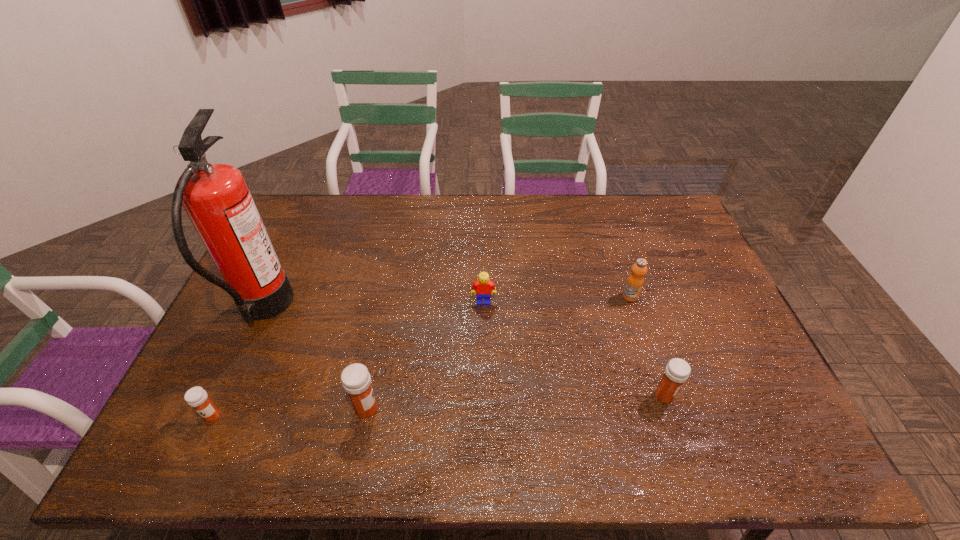
At what (x,y) coordinates should I click in order to perform the action: click on free point between the tallest object and the shortest object. Please return your answer as a coordinate pair (x, y). The height and width of the screenshot is (540, 960). Looking at the image, I should click on (237, 363).

Locate which object ranks third in proximity to the orange juice. Please provide its 2D coordinates. Your answer should be formatted as a tuple, i.e. [(x, y)], where the tuple contains the x and y coordinates of a point satisfying the conditions above.

[(356, 380)]

Find the location of a particular element. The image size is (960, 540). object that is the second closest to the fourth object from right to left is located at coordinates (196, 397).

Choose which medicine is the second nearest neighbor to the Lego. Please provide its 2D coordinates. Your answer should be formatted as a tuple, i.e. [(x, y)], where the tuple contains the x and y coordinates of a point satisfying the conditions above.

[(677, 371)]

Find the location of `medicine identified as the closest to the shortest medicine`. medicine identified as the closest to the shortest medicine is located at coordinates (356, 380).

What are the coordinates of `vacant space that satisfies the following two spatial constraints: 1. on the front-facing side of the fourth object from left to right; 2. on the label side of the tallest medicine` in the screenshot? It's located at (485, 409).

Find the location of a particular element. This screenshot has height=540, width=960. vacant region that satisfies the following two spatial constraints: 1. on the front-facing side of the fire extinguisher; 2. on the label side of the shortest object is located at coordinates (214, 416).

Find the location of a particular element. free space that satisfies the following two spatial constraints: 1. on the label side of the fourth object from right to left; 2. on the label side of the shortest object is located at coordinates (365, 416).

At what (x,y) coordinates should I click in order to perform the action: click on blank space that satisfies the following two spatial constraints: 1. on the front label of the orange juice; 2. on the label side of the third object from left to right. Please return your answer as a coordinate pair (x, y). Looking at the image, I should click on (667, 409).

At what (x,y) coordinates should I click in order to perform the action: click on free space that satisfies the following two spatial constraints: 1. on the front label of the orange juice; 2. on the front-facing side of the tallest object. Please return your answer as a coordinate pair (x, y). The height and width of the screenshot is (540, 960). Looking at the image, I should click on (635, 310).